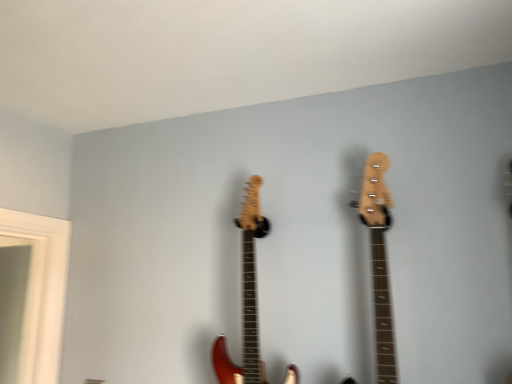
Describe the element at coordinates (246, 298) in the screenshot. The image size is (512, 384). I see `shiny red electric guitar at center` at that location.

Measure the distance between shiny red electric guitar at center and camera.

The distance of shiny red electric guitar at center from camera is 1.28 meters.

This screenshot has width=512, height=384. Identify the location of shiny red electric guitar at center. (246, 298).

Where is `shiny red electric guitar at center`? The width and height of the screenshot is (512, 384). shiny red electric guitar at center is located at coordinates (246, 298).